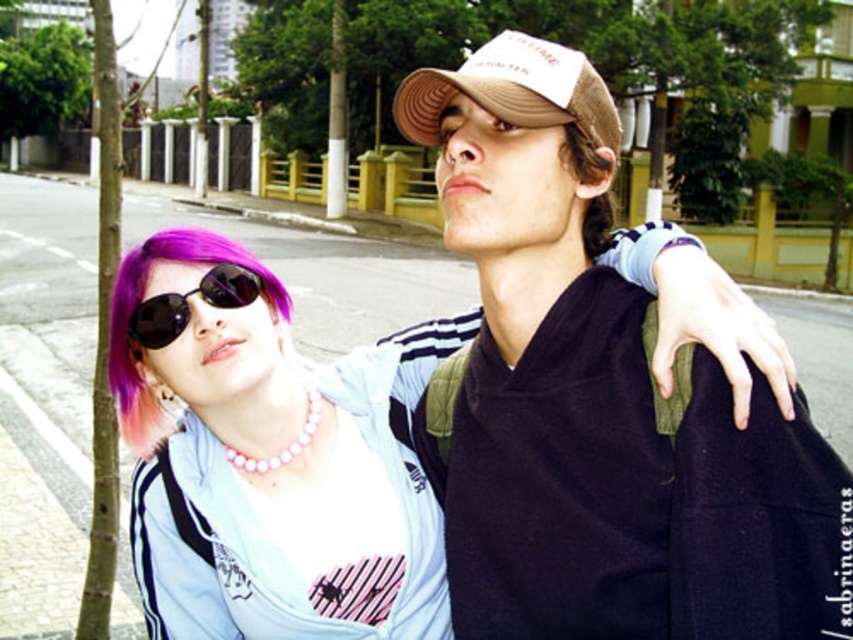
Is brown mesh cap at upper center shorter than pearl necklace at center?

No, brown mesh cap at upper center is not shorter than pearl necklace at center.

Is the position of brown mesh cap at upper center more distant than that of pearl necklace at center?

That is False.

Locate an element on the screen. The height and width of the screenshot is (640, 853). brown mesh cap at upper center is located at coordinates (604, 401).

Can you confirm if brown mesh cap at upper center is wider than black reflective sunglasses at upper left?

Yes, brown mesh cap at upper center is wider than black reflective sunglasses at upper left.

Between point (486, 419) and point (152, 314), which one is positioned in front?

Point (486, 419)

Locate an element on the screen. This screenshot has height=640, width=853. brown mesh cap at upper center is located at coordinates (604, 401).

Is pink matte sunglasses at upper left thinner than brown matte hair at upper center?

No, pink matte sunglasses at upper left is not thinner than brown matte hair at upper center.

Does pink matte sunglasses at upper left lie in front of brown matte hair at upper center?

No, pink matte sunglasses at upper left is behind brown matte hair at upper center.

Who is more distant from viewer, (323, 499) or (585, 244)?

Point (323, 499)

Identify the location of pink matte sunglasses at upper left. The image size is (853, 640). (262, 464).